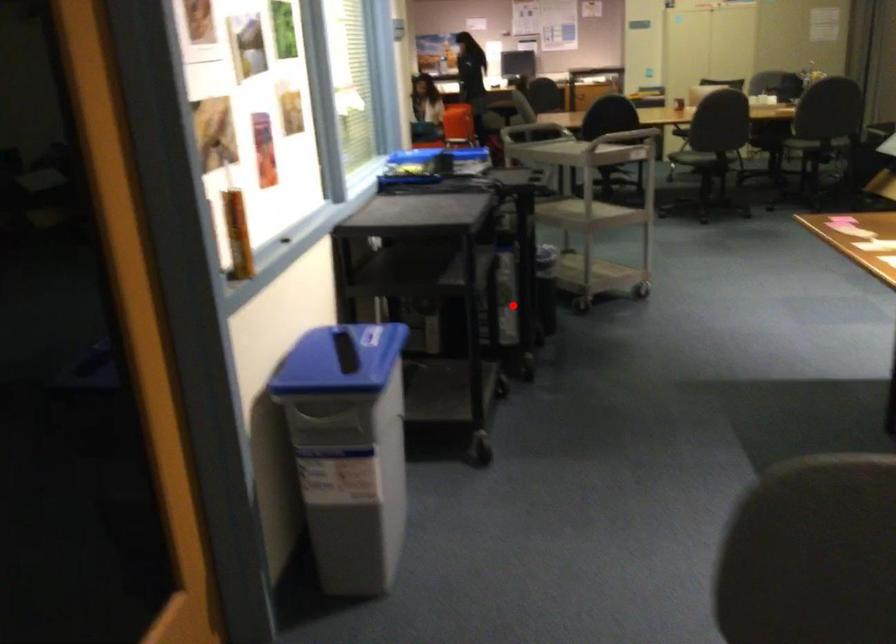
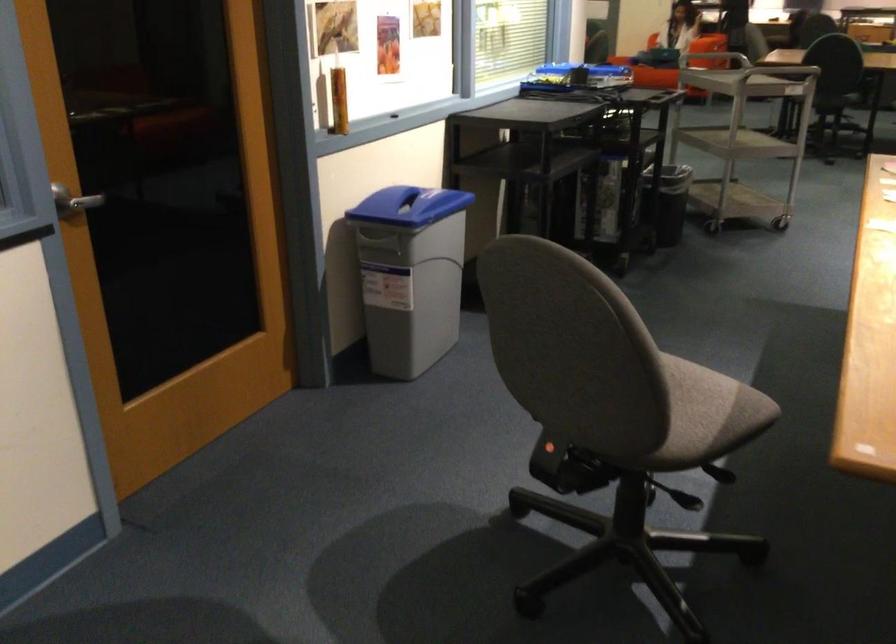
Where in the second image is the point corresponding to the highlighted location from the first image?

(607, 200)